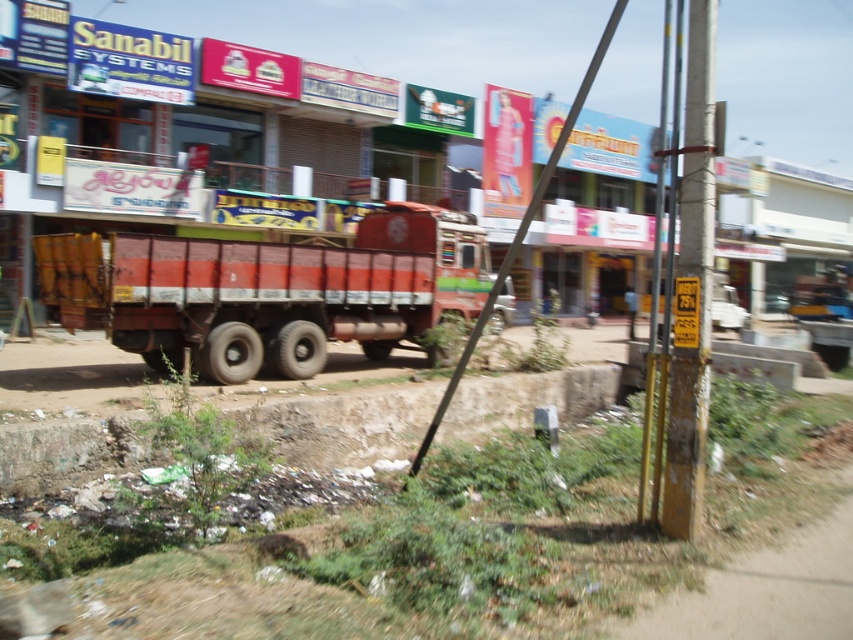
Does red matte truck at center appear on the left side of yellow painted wood pole at right?

Indeed, red matte truck at center is positioned on the left side of yellow painted wood pole at right.

Between point (227, 296) and point (677, 456), which one is positioned behind?

Positioned behind is point (227, 296).

Locate an element on the screen. red matte truck at center is located at coordinates (267, 291).

Between brown dirt at lower left and metallic pole at right, which one has more height?

metallic pole at right is taller.

Is point (32, 465) behind point (664, 19)?

No, it is not.

Image resolution: width=853 pixels, height=640 pixels. I want to click on brown dirt at lower left, so click(x=769, y=593).

Can you confirm if brown dirt at lower left is thinner than yellow painted wood pole at right?

No.

Who is taller, brown dirt at lower left or yellow painted wood pole at right?

With more height is yellow painted wood pole at right.

Locate an element on the screen. brown dirt at lower left is located at coordinates (769, 593).